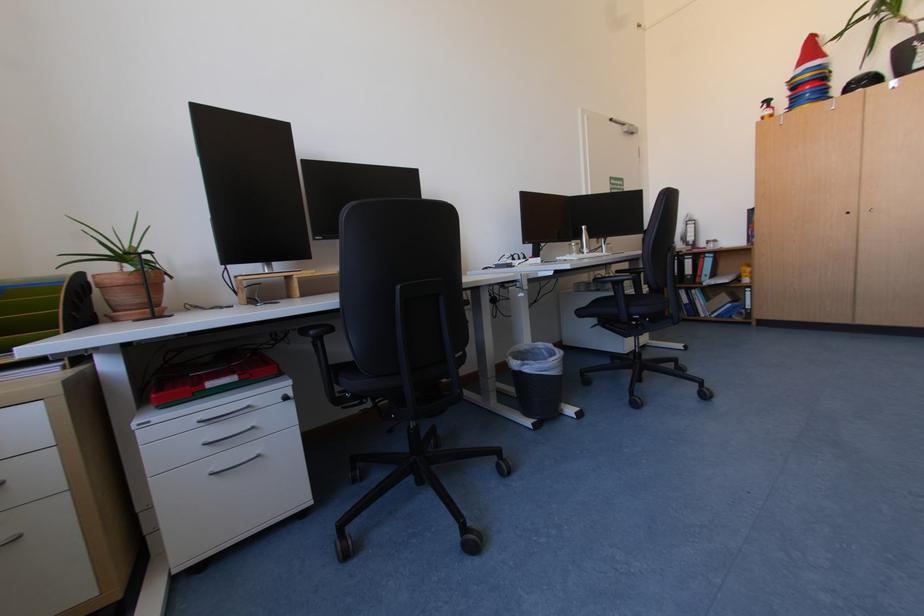
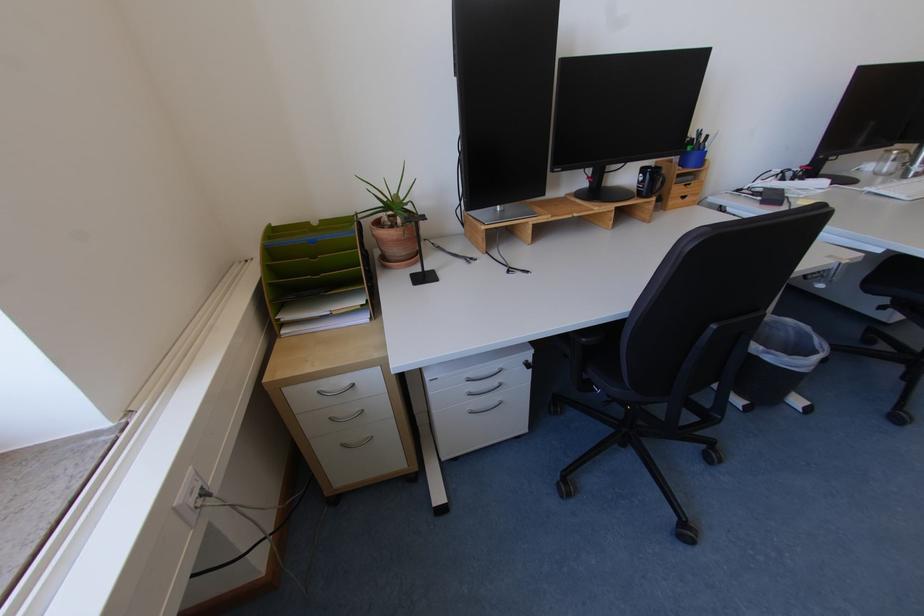
Locate, in the second image, the point that corresponds to (x=128, y=283) in the first image.

(403, 238)